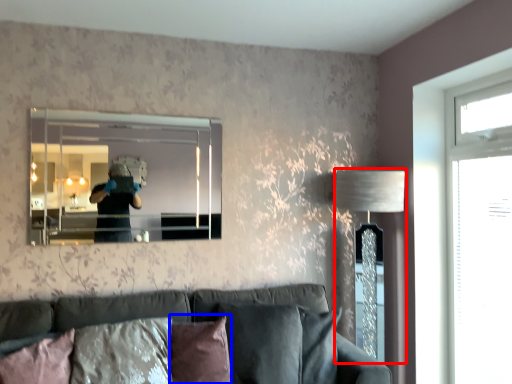
Question: Which of the following is the farthest to the observer, table lamp (highlighted by a red box) or pillow (highlighted by a blue box)?

Choices:
 (A) table lamp
 (B) pillow

Answer: (A)